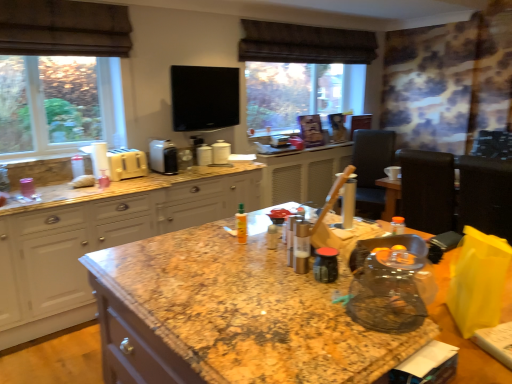
Question: Can you confirm if white glossy canister at center, marked as the 4th appliance in a left-to-right arrangement, is positioned to the right of granite at center?

Choices:
 (A) yes
 (B) no

Answer: (B)

Question: Does white glossy canister at center, marked as the 4th appliance in a left-to-right arrangement, have a smaller size compared to granite at center?

Choices:
 (A) no
 (B) yes

Answer: (B)

Question: Is white glossy canister at center, marked as the 4th appliance in a left-to-right arrangement, shorter than granite at center?

Choices:
 (A) no
 (B) yes

Answer: (B)

Question: Is white glossy canister at center, marked as the 4th appliance in a left-to-right arrangement, in contact with granite at center?

Choices:
 (A) no
 (B) yes

Answer: (A)

Question: From the image's perspective, is white glossy canister at center, marked as the 4th appliance in a left-to-right arrangement, over granite at center?

Choices:
 (A) yes
 (B) no

Answer: (A)

Question: Is bread dough at left spatially inside granite at center, or outside of it?

Choices:
 (A) inside
 (B) outside

Answer: (B)

Question: From the image's perspective, is bread dough at left positioned above or below granite at center?

Choices:
 (A) above
 (B) below

Answer: (A)

Question: Is point (81, 177) closer or farther from the camera than point (142, 336)?

Choices:
 (A) farther
 (B) closer

Answer: (A)

Question: From a real-world perspective, is bread dough at left positioned above or below granite at center?

Choices:
 (A) below
 (B) above

Answer: (B)

Question: From a real-world perspective, is black leather chair at right, which is counted as the second chair, starting from the back, positioned above or below white glossy canisters at center, the second appliance from the right?

Choices:
 (A) below
 (B) above

Answer: (A)

Question: In terms of size, does black leather chair at right, which is counted as the second chair, starting from the back, appear bigger or smaller than white glossy canisters at center, the second appliance from the right?

Choices:
 (A) small
 (B) big

Answer: (B)

Question: Considering the positions of black leather chair at right, which appears as the first chair when viewed from the front, and white glossy canisters at center, arranged as the 3th appliance when viewed from the left, in the image, is black leather chair at right, which appears as the first chair when viewed from the front, taller or shorter than white glossy canisters at center, arranged as the 3th appliance when viewed from the left,?

Choices:
 (A) short
 (B) tall

Answer: (B)

Question: Is point (415, 210) positioned closer to the camera than point (198, 165)?

Choices:
 (A) closer
 (B) farther

Answer: (A)

Question: In terms of width, does yellow matte bottle at center look wider or thinner when compared to matte granite countertop at left?

Choices:
 (A) thin
 (B) wide

Answer: (A)

Question: Is yellow matte bottle at center inside the boundaries of matte granite countertop at left, or outside?

Choices:
 (A) inside
 (B) outside

Answer: (B)